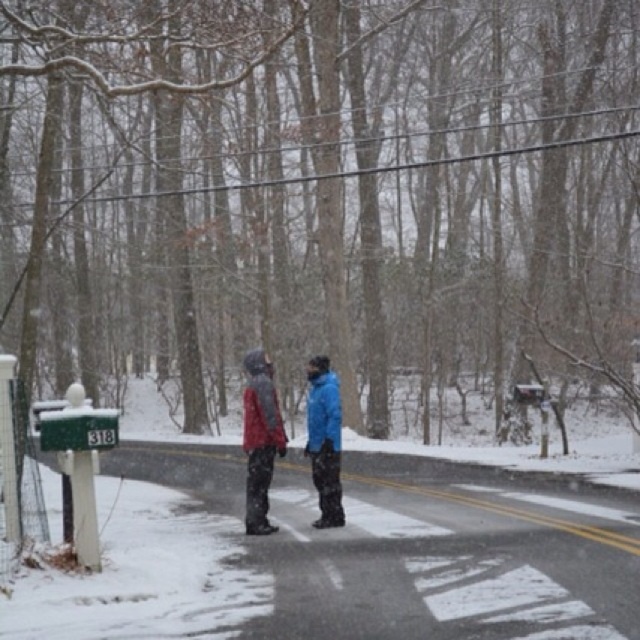
Looking at this image, you are a delivery person trying to deliver a package to the blue matte jacket at center. There is a matte blue jacket at center blocking the path. Can you walk around them to reach your destination?

The matte blue jacket at center is to the left of the blue matte jacket at center, so you can walk around to the right side of the matte blue jacket at center to reach the blue matte jacket at center.

You are a delivery driver who needs to park your vehicle at the point marked by the coordinates point [259,484]. The length of your delivery van is 6 meters. Can you safely park your van at that point without exceeding the boundaries of the road?

The distance between point [259,484] and the camera is 13.54 meters. Since your van is only 6 meters long, it can safely park at that point as there is sufficient space available.